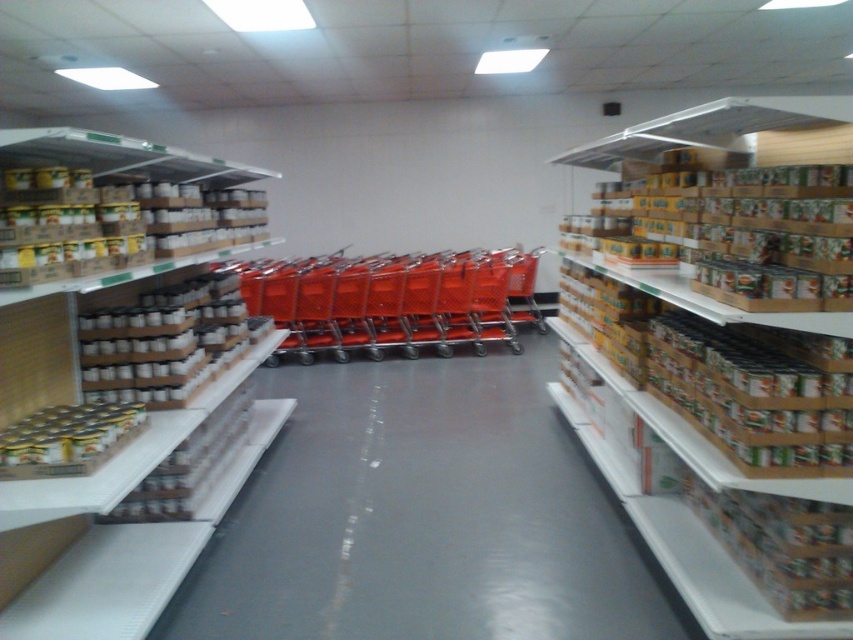
Is matte cardboard boxes at left in front of metallic orange shopping cart at center?

That is True.

Does point (109, 468) come behind point (439, 269)?

No, it is not.

The image size is (853, 640). In order to click on matte cardboard boxes at left in this screenshot , I will do `click(120, 440)`.

Does brown cardboard boxes at right have a greater height compared to matte cardboard boxes at left?

Indeed, brown cardboard boxes at right has a greater height compared to matte cardboard boxes at left.

Which is in front, point (654, 417) or point (158, 364)?

Point (654, 417) is in front.

The width and height of the screenshot is (853, 640). I want to click on brown cardboard boxes at right, so click(727, 356).

Is white cardboard boxes at left below matte cardboard boxes at left?

Indeed, white cardboard boxes at left is positioned under matte cardboard boxes at left.

Measure the distance between white cardboard boxes at left and camera.

They are 7.64 feet apart.

Where is `white cardboard boxes at left`? white cardboard boxes at left is located at coordinates click(x=422, y=516).

The width and height of the screenshot is (853, 640). What are the coordinates of `white cardboard boxes at left` in the screenshot? It's located at (422, 516).